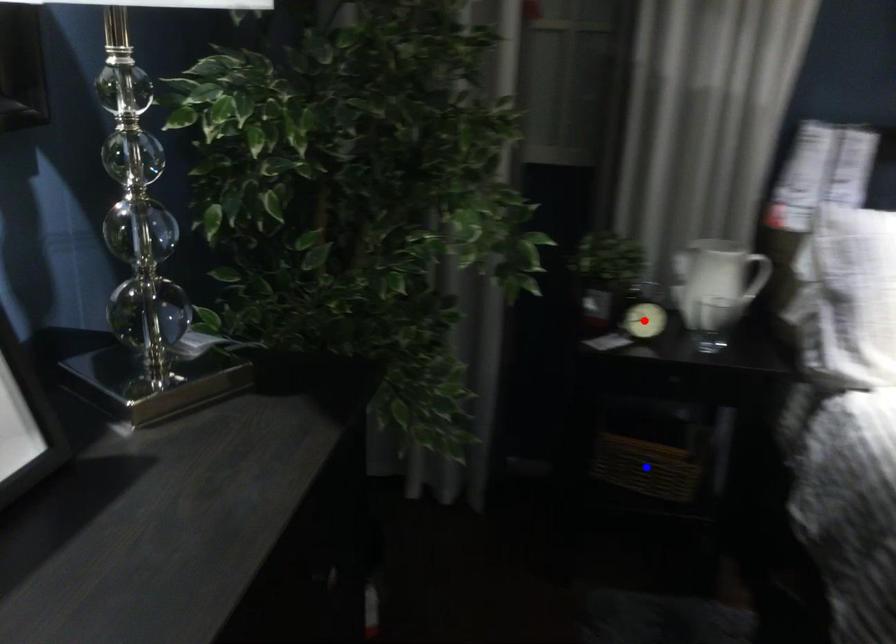
Question: In the image, two points are highlighted. Which point is nearer to the camera? Reply with the corresponding letter.

Choices:
 (A) blue point
 (B) red point

Answer: (B)